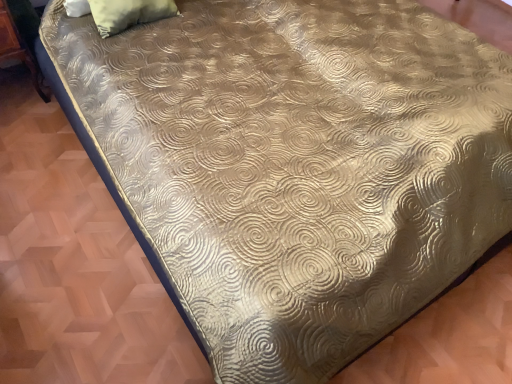
The image size is (512, 384). I want to click on free location to the right of wooden dresser at left, so click(50, 117).